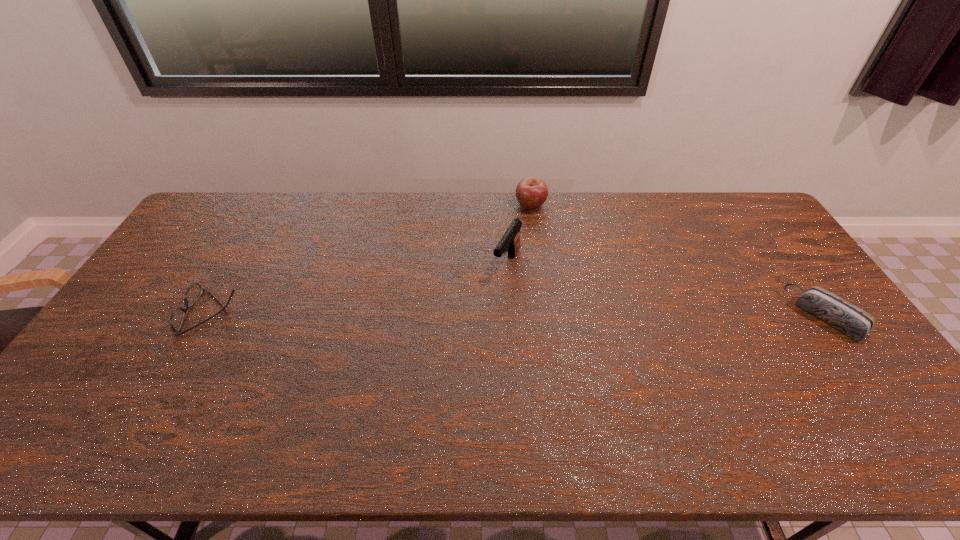
The image size is (960, 540). Identify the location of vacant space situated 0.110m on the front-facing side of the leftmost object. (148, 313).

In order to click on free space located 0.380m on the left of the rightmost object in this screenshot , I will do `click(664, 315)`.

What are the coordinates of `vacant space located on the side of the farthest object with the unique marking` in the screenshot? It's located at (509, 267).

The image size is (960, 540). Find the location of `vacant space situated on the side of the farthest object with the unique marking`. vacant space situated on the side of the farthest object with the unique marking is located at coordinates (510, 265).

You are a GUI agent. You are given a task and a screenshot of the screen. Output one action in this format:
    pyautogui.click(x=<x>, y=<y>)
    Task: Click on the vacant space located 0.340m on the side of the farthest object with the unique marking
    
    Given the screenshot: What is the action you would take?
    pyautogui.click(x=505, y=278)

Find the location of a particular element. vacant space located 0.380m at the barrel of the tallest object is located at coordinates (444, 379).

Locate an element on the screen. This screenshot has width=960, height=540. free space located at the barrel of the tallest object is located at coordinates (486, 308).

Locate an element on the screen. The width and height of the screenshot is (960, 540). vacant space situated 0.090m at the barrel of the tallest object is located at coordinates (490, 301).

You are a GUI agent. You are given a task and a screenshot of the screen. Output one action in this format:
    pyautogui.click(x=<x>, y=<y>)
    Task: Click on the object that is at the far edge
    This screenshot has height=540, width=960.
    Given the screenshot: What is the action you would take?
    pyautogui.click(x=531, y=193)

Locate an element on the screen. The image size is (960, 540). object that is at the right edge is located at coordinates (837, 312).